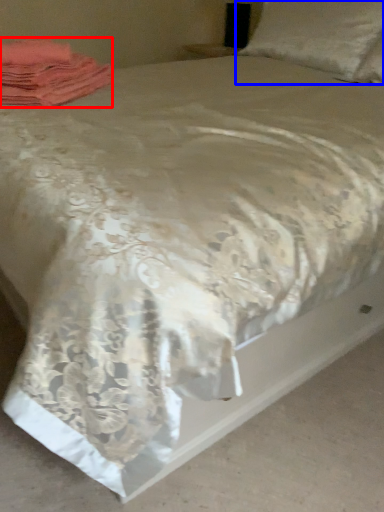
Question: Which of the following is the closest to the observer, material (highlighted by a red box) or pillow (highlighted by a blue box)?

Choices:
 (A) material
 (B) pillow

Answer: (A)